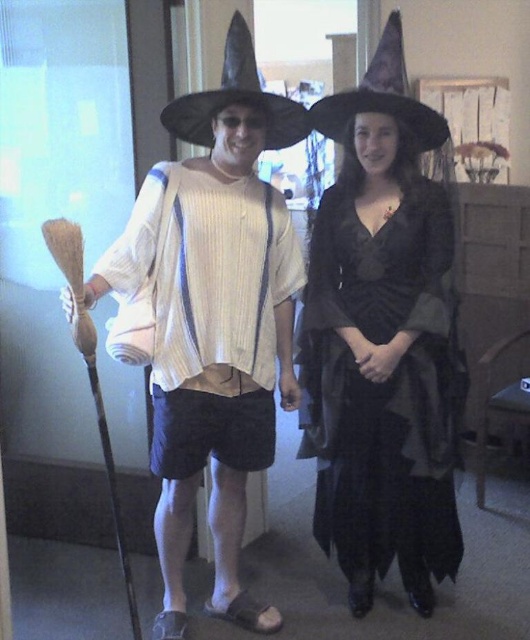
Question: Does black satin dress at center appear on the right side of black felt witch hat at upper center?

Choices:
 (A) no
 (B) yes

Answer: (B)

Question: Which of the following is the farthest from the observer?

Choices:
 (A) black satin dress at center
 (B) black felt witch hat at center
 (C) black felt witch hat at upper center

Answer: (A)

Question: Estimate the real-world distances between objects in this image. Which object is closer to the black felt witch hat at upper center?

Choices:
 (A) black satin dress at center
 (B) black felt witch hat at center

Answer: (B)

Question: Does black felt witch hat at center have a lesser width compared to black felt witch hat at upper center?

Choices:
 (A) no
 (B) yes

Answer: (A)

Question: Is black felt witch hat at center to the right of black felt witch hat at upper center from the viewer's perspective?

Choices:
 (A) yes
 (B) no

Answer: (B)

Question: Which of the following is the farthest from the observer?

Choices:
 (A) (342, 364)
 (B) (399, 67)
 (C) (246, 68)

Answer: (A)